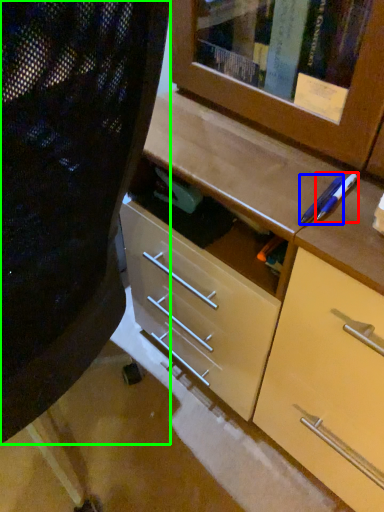
Question: Which object is the closest to the pencil (highlighted by a red box)? Choose among these: pencil (highlighted by a blue box) or folding chair (highlighted by a green box).

Choices:
 (A) pencil
 (B) folding chair

Answer: (A)